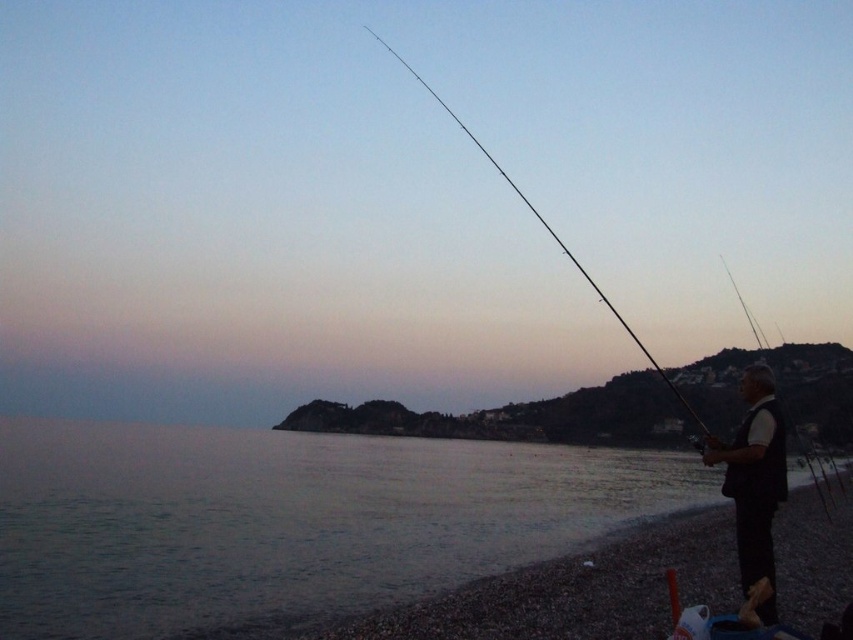
You are a photographer trying to capture both the black rod fishing pole at center and the smooth black rod at right in the same frame. Given their distance apart, do you think you can fit both into your camera viewfinder without moving closer or further away?

The black rod fishing pole at center is 321.93 feet away from the smooth black rod at right. Since the distance between them is quite large, it might be challenging to fit both into the camera viewfinder without adjusting your position. However, using a wide angle lens could help capture both objects in the same frame.